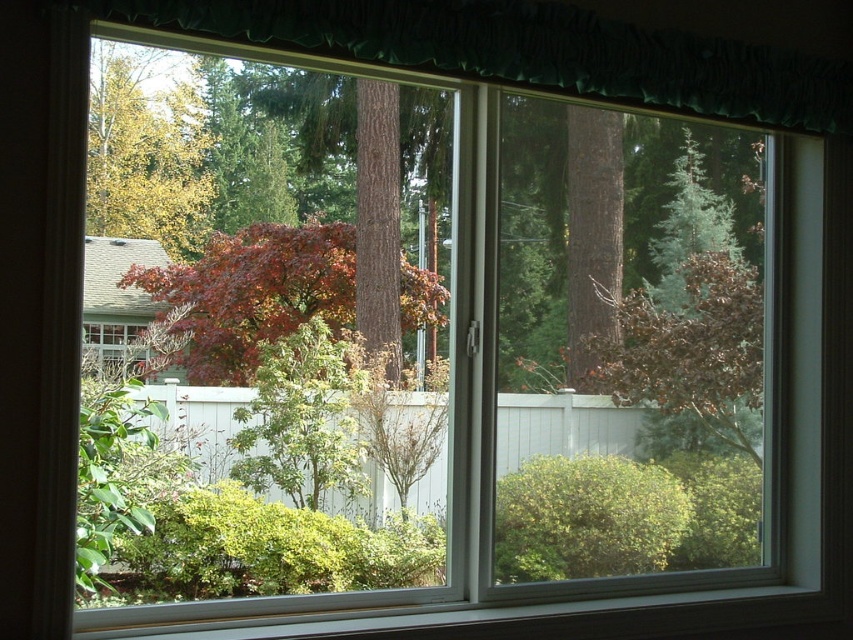
Question: Among these points, which one is nearest to the camera?

Choices:
 (A) (166, 150)
 (B) (764, 118)

Answer: (A)

Question: Does green textured curtain at upper center appear on the left side of green matte tree at upper left?

Choices:
 (A) yes
 (B) no

Answer: (B)

Question: Which object appears farthest from the camera in this image?

Choices:
 (A) green matte tree at upper left
 (B) green textured curtain at upper center

Answer: (A)

Question: Which point is closer to the camera?

Choices:
 (A) green matte tree at upper left
 (B) green textured curtain at upper center

Answer: (B)

Question: Where is green textured curtain at upper center located in relation to green matte tree at upper left in the image?

Choices:
 (A) above
 (B) below

Answer: (A)

Question: Can you confirm if green textured curtain at upper center is positioned below green matte tree at upper left?

Choices:
 (A) yes
 (B) no

Answer: (B)